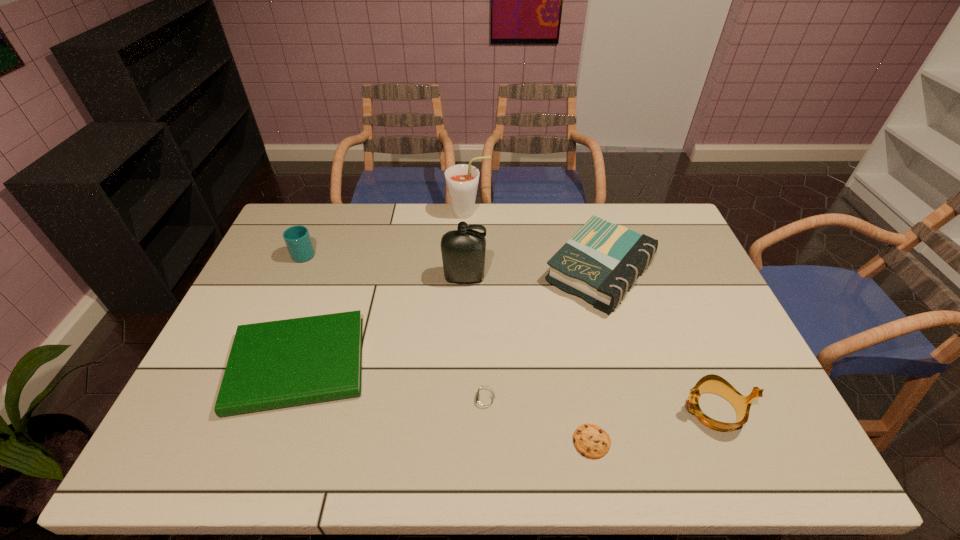
This screenshot has width=960, height=540. Find the location of `free spot between the root beer and the left paperback book`. free spot between the root beer and the left paperback book is located at coordinates (383, 289).

Where is `vacant point located between the bottle and the cup`? vacant point located between the bottle and the cup is located at coordinates (385, 265).

The image size is (960, 540). What are the coordinates of `vacant region between the left paperback book and the right paperback book` in the screenshot? It's located at (449, 318).

Locate an element on the screen. The width and height of the screenshot is (960, 540). unoccupied position between the tiara and the root beer is located at coordinates (591, 312).

Where is `free spot between the watch and the cup`? This screenshot has height=540, width=960. free spot between the watch and the cup is located at coordinates [x=395, y=327].

Find the location of a particular element. The height and width of the screenshot is (540, 960). vacant point located between the shorter paperback book and the bottle is located at coordinates (381, 321).

Identify the location of empty location between the cookie and the third shortest object. (445, 403).

This screenshot has width=960, height=540. I want to click on empty location between the shortest object and the cup, so click(x=448, y=347).

Select which object appears as the seventh closest to the farthest object. Please provide its 2D coordinates. Your answer should be formatted as a tuple, i.e. [(x, y)], where the tuple contains the x and y coordinates of a point satisfying the conditions above.

[(711, 383)]

Locate which object is the third closest to the nearer paperback book. Please provide its 2D coordinates. Your answer should be formatted as a tuple, i.e. [(x, y)], where the tuple contains the x and y coordinates of a point satisfying the conditions above.

[(484, 400)]